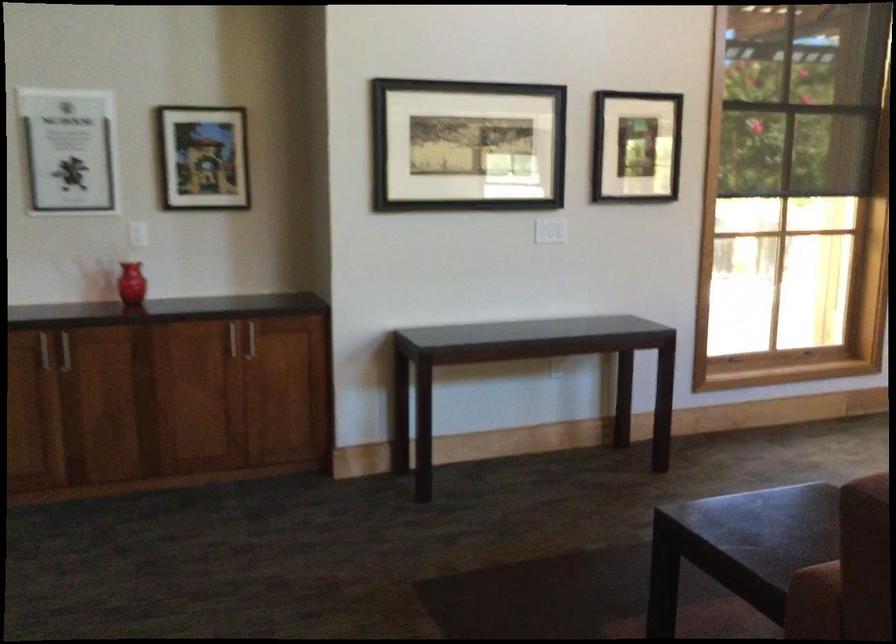
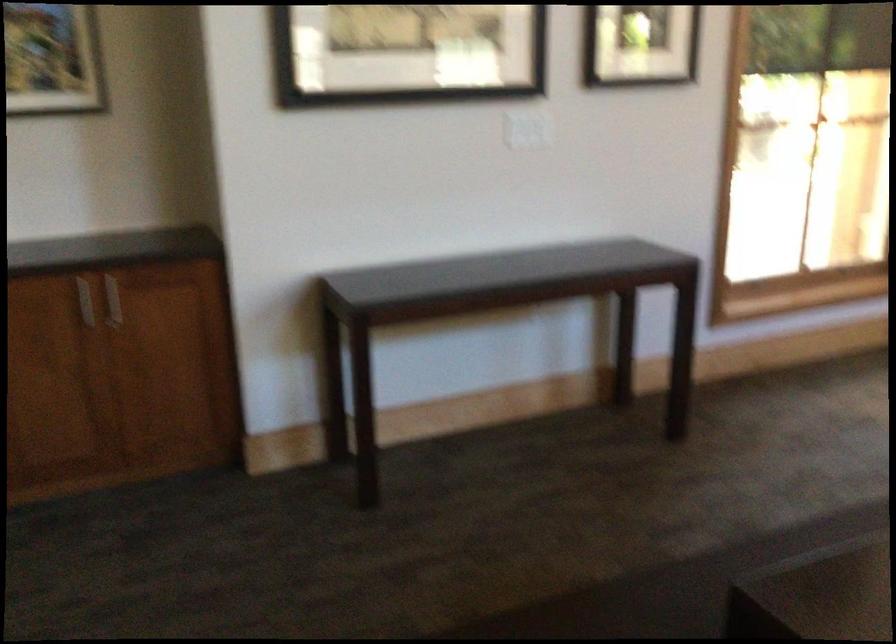
Question: How did the camera likely rotate?

Choices:
 (A) Left
 (B) Right
 (C) Up
 (D) Down

Answer: (D)